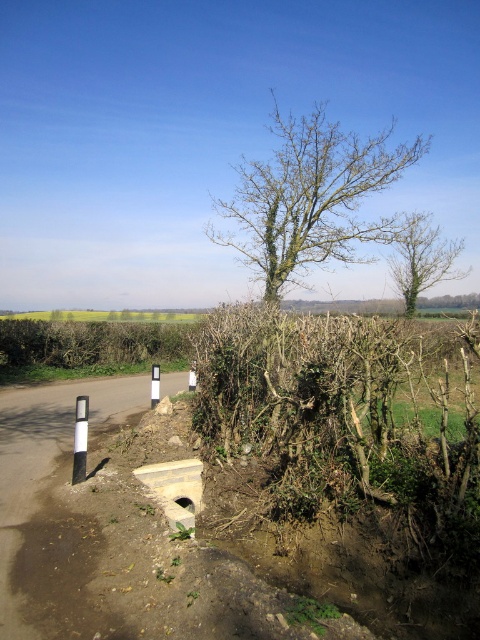
You are a landscape architect designing a garden layout. You need to place a new statue that requires a base height of 1.2 meters. The statue must be positioned so that it is visible from both the green leafy hedge at center and the white plastic pole at left. Given their heights, which object will the statue be more likely to block the view of from the other?

The green leafy hedge at center has a lesser height compared to white plastic pole at left. Since the statue requires a base height of 1.2 meters, it will block the view of the shorter green leafy hedge at center from the taller white plastic pole at left, as the statue would be taller than the hedge.